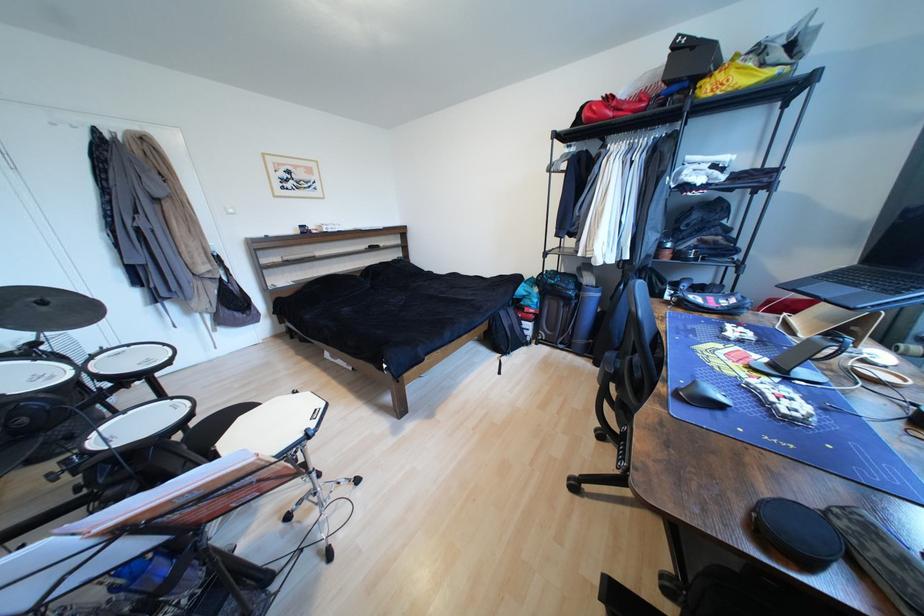
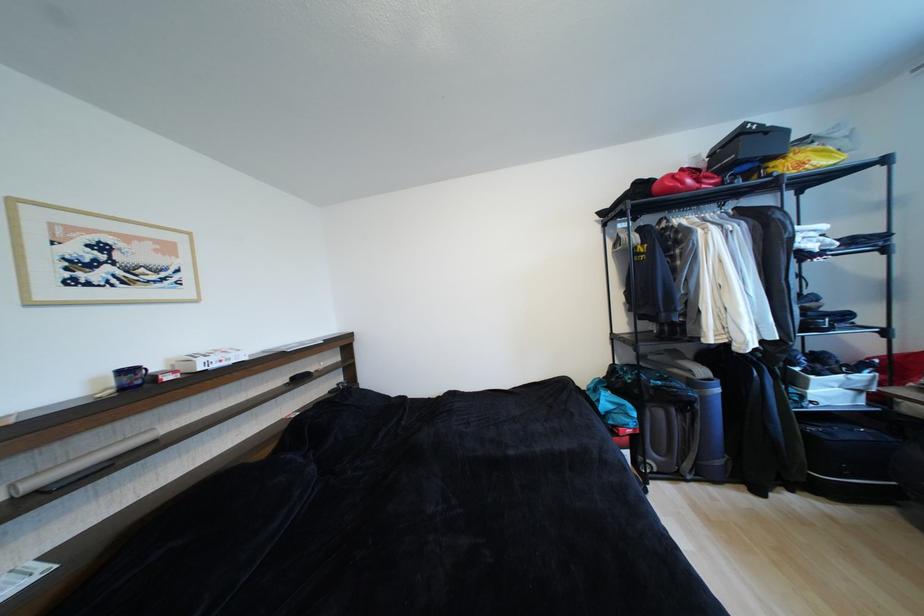
Where in the second image is the point corresponding to point (293, 259) from the first image?

(40, 485)